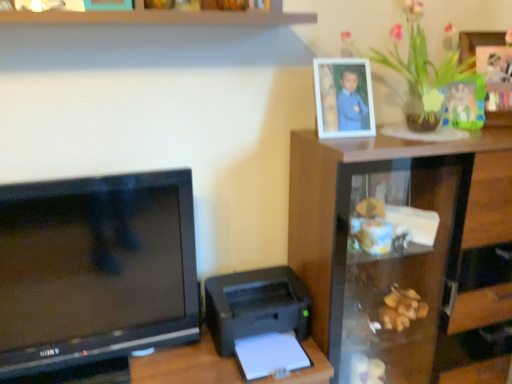
Where is `vacant area situated below black plastic printer at lower right (from a real-world perspective)`? vacant area situated below black plastic printer at lower right (from a real-world perspective) is located at coordinates (260, 352).